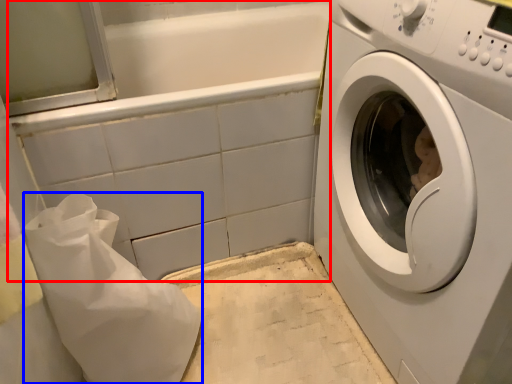
Question: Which object is further to the camera taking this photo, bath (highlighted by a red box) or material (highlighted by a blue box)?

Choices:
 (A) bath
 (B) material

Answer: (A)